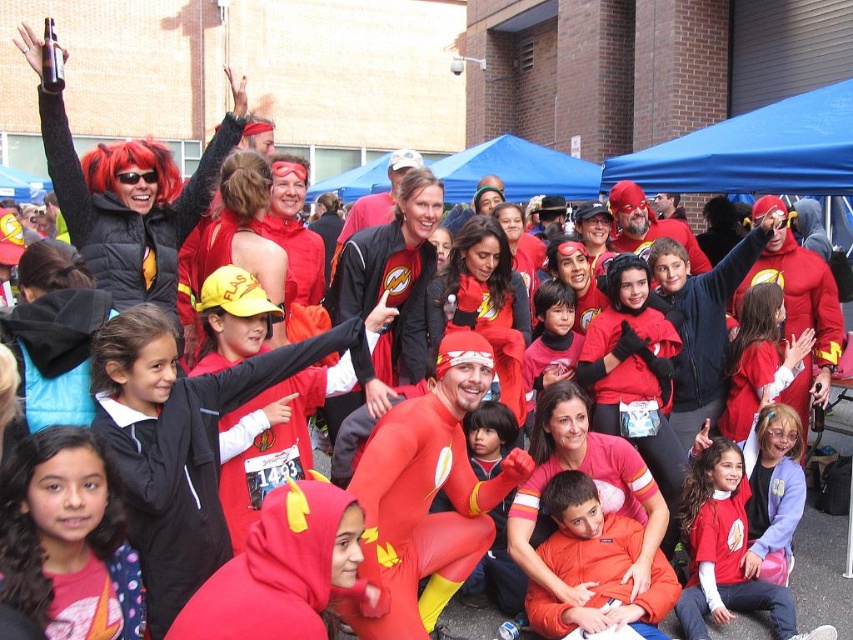
Question: Is matte red shirt at lower center above light purple fleece jacket at lower right?

Choices:
 (A) no
 (B) yes

Answer: (A)

Question: Considering the real-world distances, which object is farthest from the smooth red costume at center?

Choices:
 (A) light purple fleece jacket at lower right
 (B) pink fleece hoodie at center
 (C) matte red shirt at lower center
 (D) matte red hoodie at center

Answer: (B)

Question: Is pink fleece hoodie at center to the left of smooth red costume at center from the viewer's perspective?

Choices:
 (A) no
 (B) yes

Answer: (B)

Question: Estimate the real-world distances between objects in this image. Which object is farther from the smooth red costume at center?

Choices:
 (A) pink fleece hoodie at center
 (B) matte red hoodie at center
 (C) light purple fleece jacket at lower right
 (D) matte red shirt at lower center

Answer: (A)

Question: Does pink fleece hoodie at center appear on the left side of smooth red costume at center?

Choices:
 (A) no
 (B) yes

Answer: (B)

Question: Among these points, which one is farthest from the camera?

Choices:
 (A) (775, 541)
 (B) (102, 548)

Answer: (A)